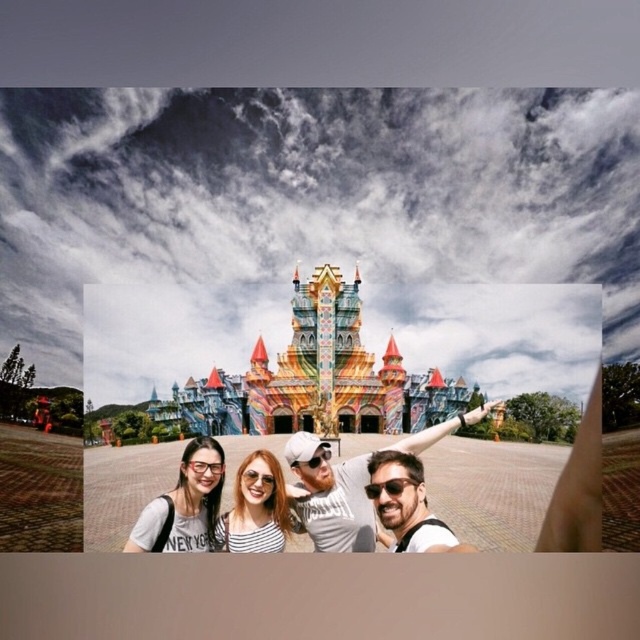
Who is more distant from viewer, (x=394, y=384) or (x=492, y=403)?

The point (x=492, y=403) is more distant.

Who is positioned more to the right, multicolored painted castle at center or matte white cap at center?

matte white cap at center

Find the location of a particular element. The height and width of the screenshot is (640, 640). multicolored painted castle at center is located at coordinates (314, 378).

Locate an element on the screen. multicolored painted castle at center is located at coordinates pos(314,378).

This screenshot has height=640, width=640. Find the location of `multicolored painted castle at center`. multicolored painted castle at center is located at coordinates (314, 378).

Between point (360, 312) and point (376, 470), which one is positioned in front?

Point (376, 470)

Locate an element on the screen. multicolored painted castle at center is located at coordinates (314, 378).

Does matte black glasses at center come in front of matte striped shirt at center?

No, matte black glasses at center is further to the viewer.

Between matte black glasses at center and matte striped shirt at center, which one appears on the left side from the viewer's perspective?

matte black glasses at center

The width and height of the screenshot is (640, 640). In order to click on matte black glasses at center in this screenshot , I will do `click(184, 504)`.